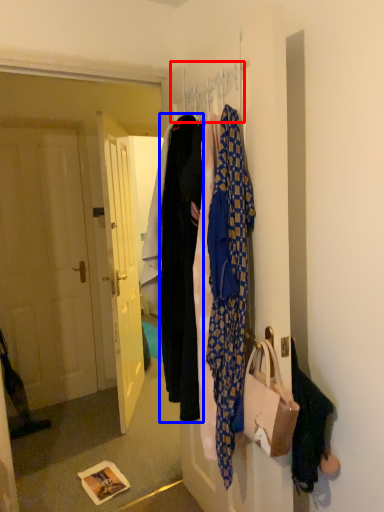
Question: Which object appears closest to the camera in this image, hanger (highlighted by a red box) or garment (highlighted by a blue box)?

Choices:
 (A) hanger
 (B) garment

Answer: (A)